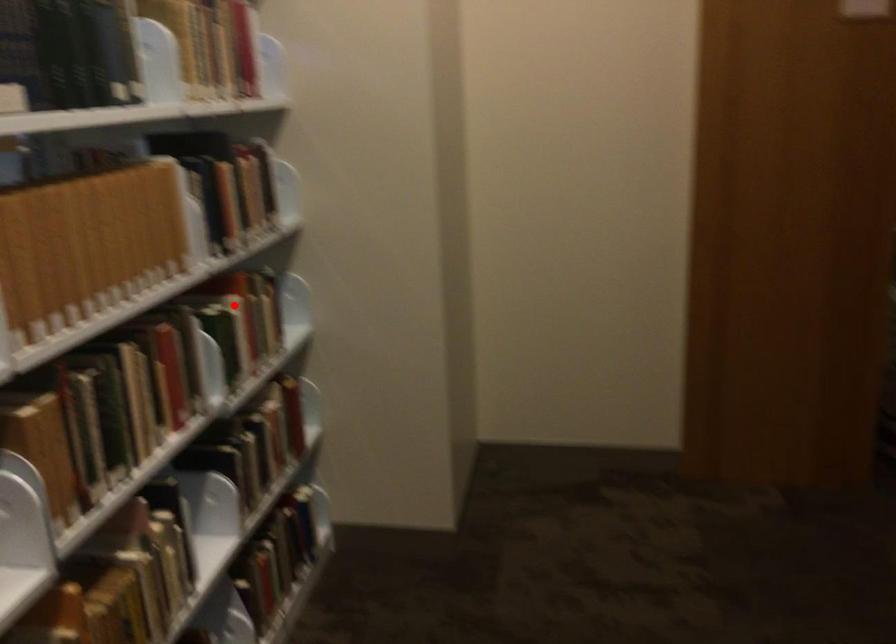
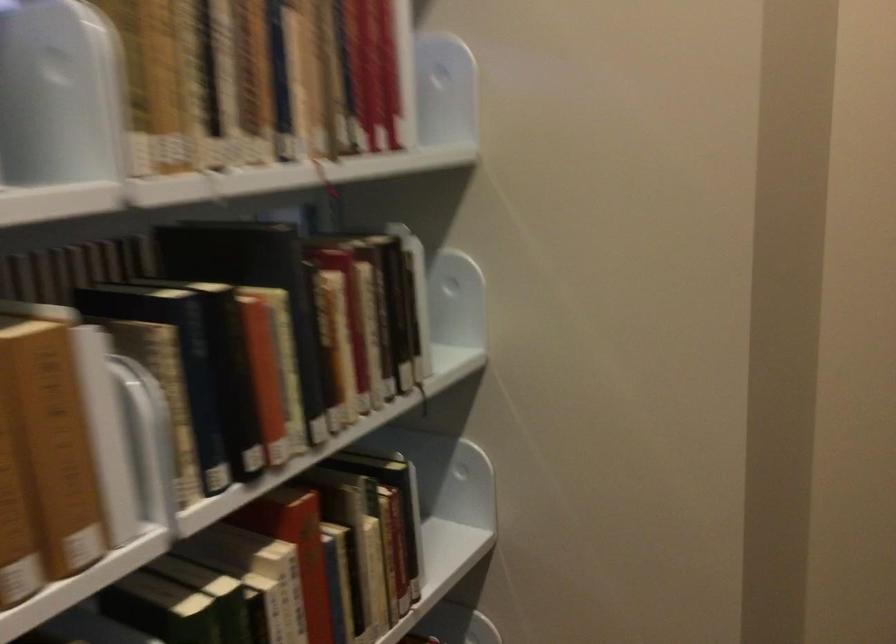
Question: I am providing you with two images of the same scene from different viewpoints. A red point is shown in image1. For the corresponding object point in image2, is it positioned nearer or farther from the camera?

Choices:
 (A) Nearer
 (B) Farther

Answer: (A)